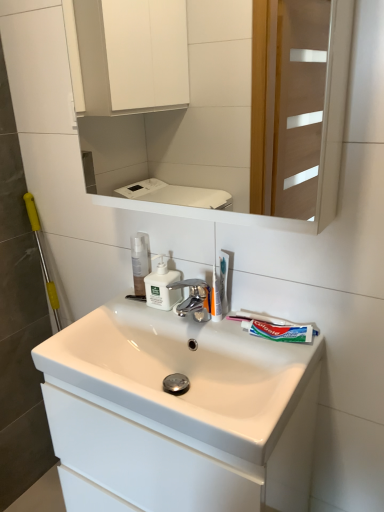
At what (x,y) coordinates should I click in order to perform the action: click on free point in front of white matte soap dispenser at center. Please return your answer as a coordinate pair (x, y). Looking at the image, I should click on (182, 322).